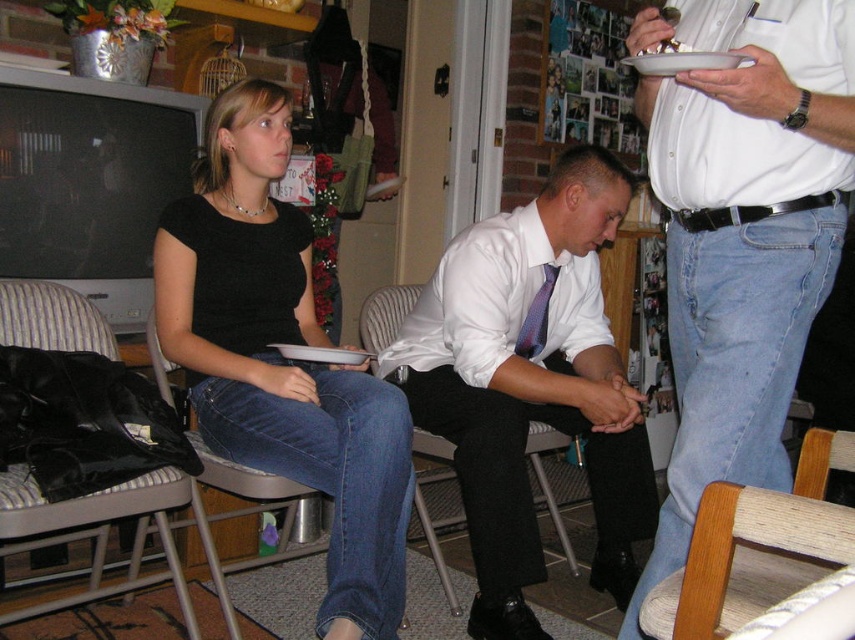
From the picture: You are standing in the living room and want to find the exact location of the point marked at coordinates (531, 384). Based on the scene description, where is this point located?

The point marked at coordinates (531, 384) is located on the white satin shirt at center.